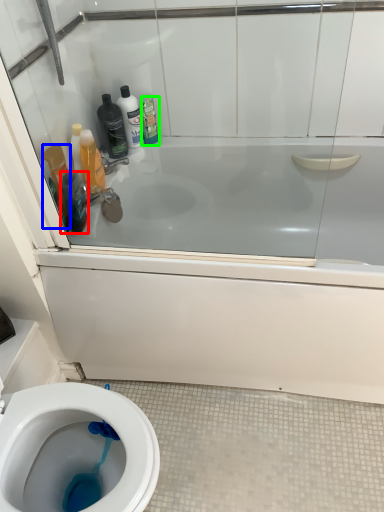
Question: Estimate the real-world distances between objects in this image. Which object is closer to mouthwash (highlighted by a red box), mouthwash (highlighted by a blue box) or cleaning product (highlighted by a green box)?

Choices:
 (A) mouthwash
 (B) cleaning product

Answer: (A)